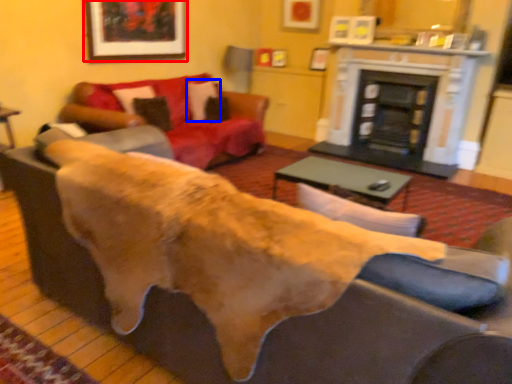
Question: Which object appears closest to the camera in this image, picture frame (highlighted by a red box) or pillow (highlighted by a blue box)?

Choices:
 (A) picture frame
 (B) pillow

Answer: (A)